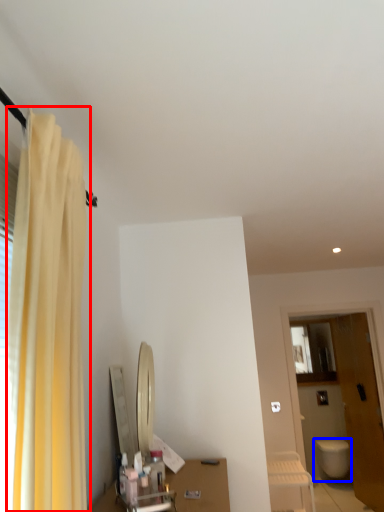
Question: Which of the following is the farthest to the observer, curtain (highlighted by a red box) or toilet (highlighted by a blue box)?

Choices:
 (A) curtain
 (B) toilet

Answer: (B)